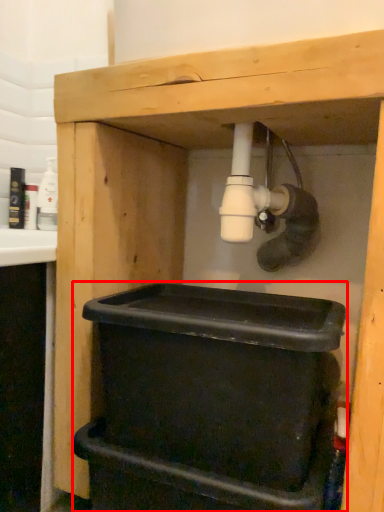
Question: From the image's perspective, where is recycling bin (annotated by the red box) located relative to bottle?

Choices:
 (A) above
 (B) below

Answer: (B)